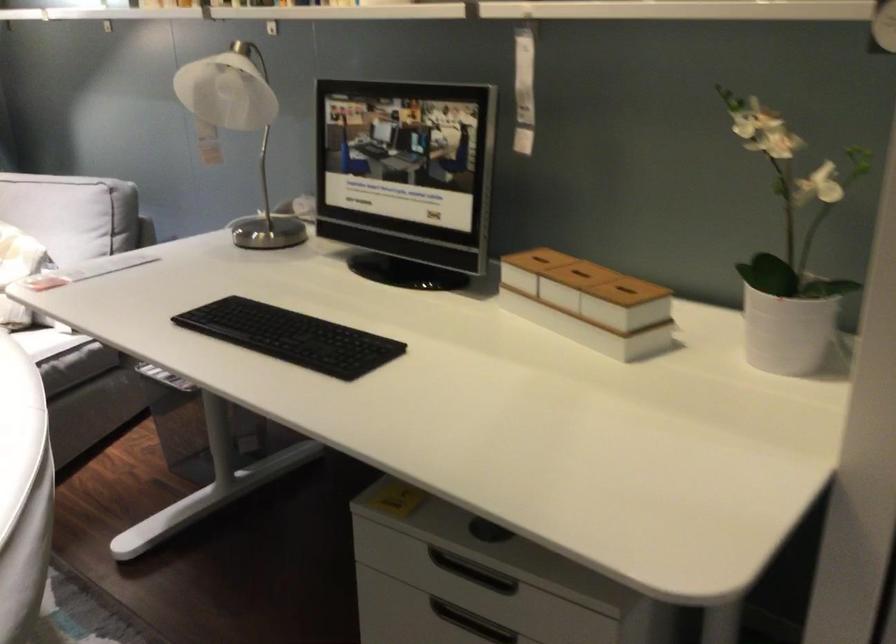
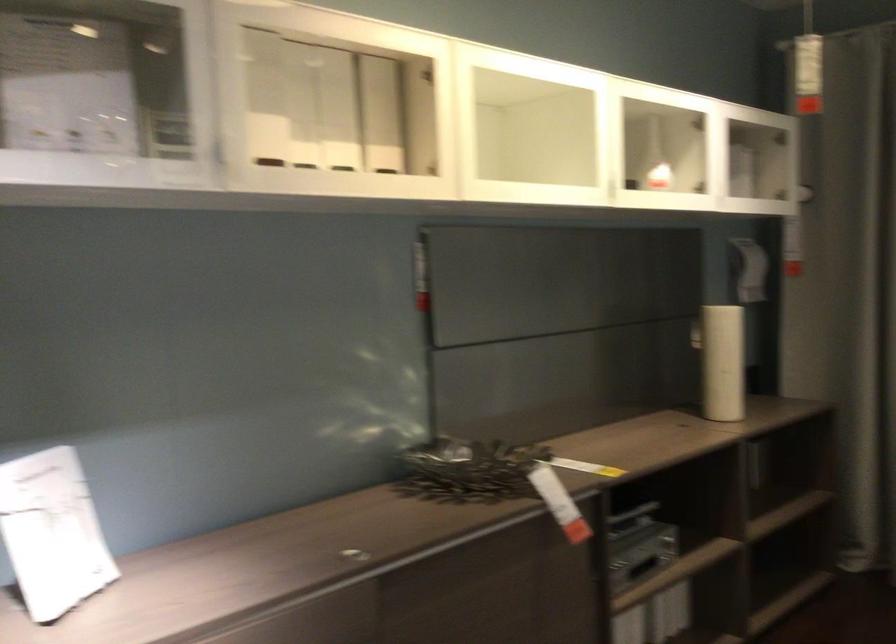
Question: The images are taken continuously from a first-person perspective. In which direction is your viewpoint rotating?

Choices:
 (A) Left
 (B) Right
 (C) Up
 (D) Down

Answer: (A)